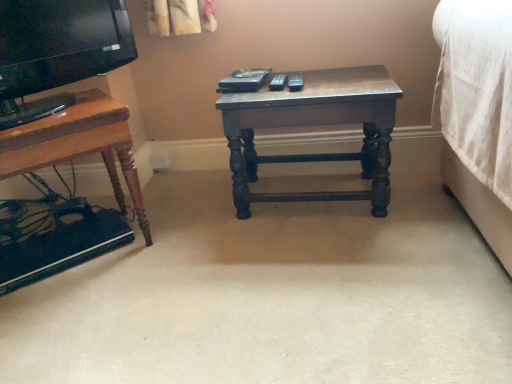
The width and height of the screenshot is (512, 384). In order to click on vacant area that lies in front of wooden table at left, placed as the second table when sorted from right to left in this screenshot , I will do `click(76, 316)`.